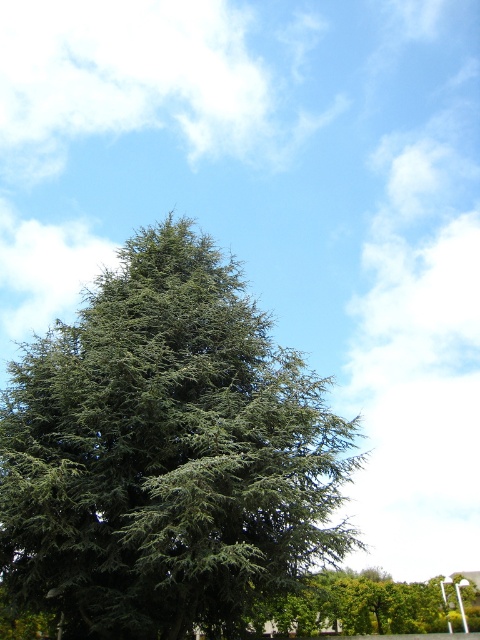
You are standing in front of the tall evergreen tree and notice a specific point marked at coordinates (x=167, y=452). Based on the scene description, where is this point located in relation to the tree?

The point at coordinates (x=167, y=452) is located on the green needle leaves at the center of the tree.